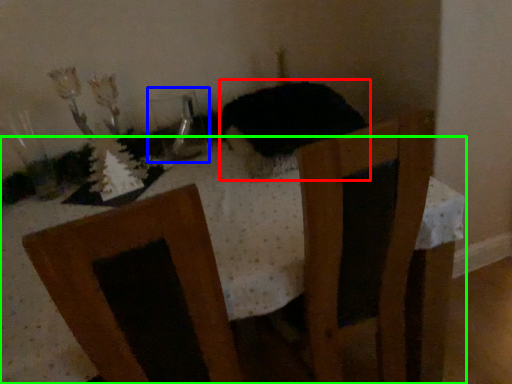
Question: Which is nearer to the animal (highlighted by a red box)? glass vase (highlighted by a blue box) or table (highlighted by a green box).

Choices:
 (A) glass vase
 (B) table

Answer: (B)